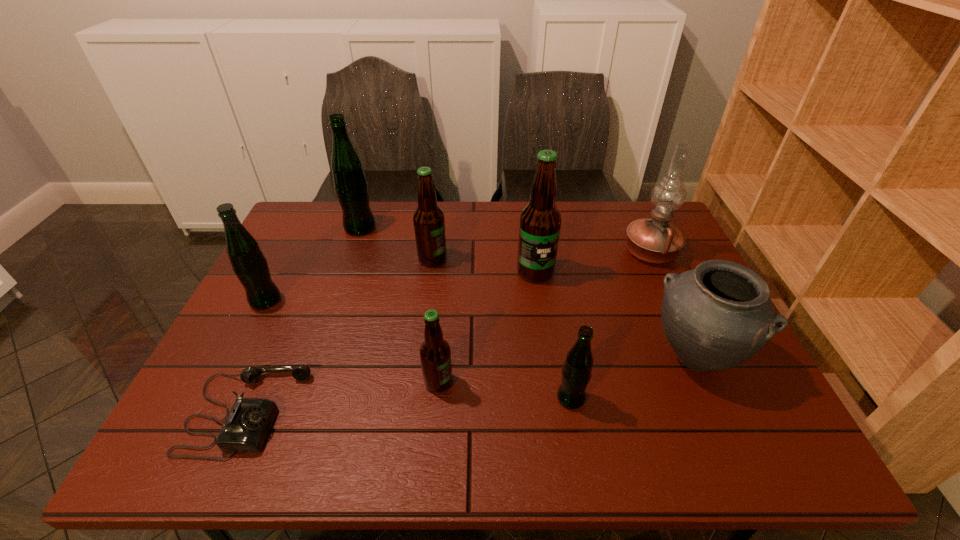
Locate which green beer bottle ranks third in proximity to the nearest brown beer bottle. Please provide its 2D coordinates. Your answer should be formatted as a tuple, i.e. [(x, y)], where the tuple contains the x and y coordinates of a point satisfying the conditions above.

[(350, 183)]

Locate an element on the screen. This screenshot has width=960, height=540. green beer bottle that is the second closest to the second green beer bottle from right to left is located at coordinates (577, 370).

Choose which brown beer bottle is the nearest neighbor to the smallest brown beer bottle. Please provide its 2D coordinates. Your answer should be formatted as a tuple, i.e. [(x, y)], where the tuple contains the x and y coordinates of a point satisfying the conditions above.

[(540, 222)]

Point out which brown beer bottle is positioned as the third nearest to the rightmost green beer bottle. Please provide its 2D coordinates. Your answer should be formatted as a tuple, i.e. [(x, y)], where the tuple contains the x and y coordinates of a point satisfying the conditions above.

[(429, 225)]

Locate an element on the screen. The width and height of the screenshot is (960, 540). vacant position in the image that satisfies the following two spatial constraints: 1. on the front side of the black urn; 2. on the dial of the shortest object is located at coordinates (719, 412).

Where is `free space that satisfies the following two spatial constraints: 1. on the front side of the black urn; 2. on the dial of the telephone`? The width and height of the screenshot is (960, 540). free space that satisfies the following two spatial constraints: 1. on the front side of the black urn; 2. on the dial of the telephone is located at coordinates (719, 412).

Locate an element on the screen. free spot that satisfies the following two spatial constraints: 1. on the front side of the farthest green beer bottle; 2. on the right side of the black urn is located at coordinates (316, 356).

This screenshot has width=960, height=540. Identify the location of free space in the image that satisfies the following two spatial constraints: 1. on the label of the second biggest brown beer bottle; 2. on the left side of the urn. (420, 356).

Identify the location of free space that satisfies the following two spatial constraints: 1. on the label of the black urn; 2. on the left side of the biggest brown beer bottle. (547, 356).